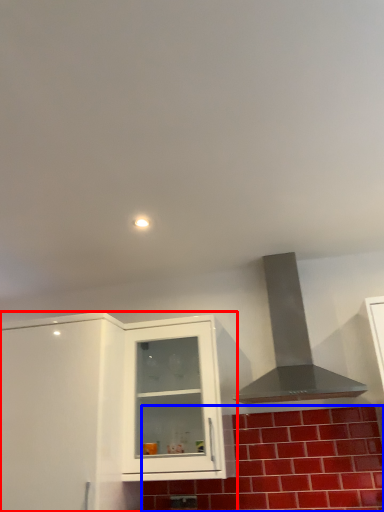
Question: Which of the following is the closest to the observer, cabinetry (highlighted by a red box) or brick (highlighted by a blue box)?

Choices:
 (A) cabinetry
 (B) brick

Answer: (A)